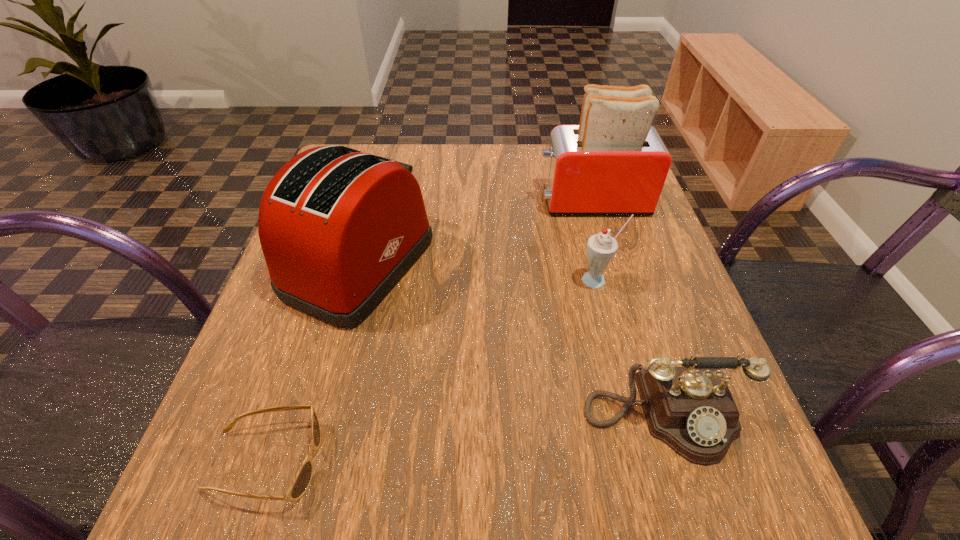
This screenshot has width=960, height=540. Find the location of `free area in between the left toaster and the milkshake`. free area in between the left toaster and the milkshake is located at coordinates (479, 273).

The image size is (960, 540). I want to click on object that is the second closest to the right toaster, so click(x=339, y=228).

Where is `the third closest object to the right toaster`? The height and width of the screenshot is (540, 960). the third closest object to the right toaster is located at coordinates (690, 409).

Image resolution: width=960 pixels, height=540 pixels. What are the coordinates of `vacant space that satisfies the following two spatial constraints: 1. on the straw side of the milkshake; 2. on the front-facing side of the sunglasses` in the screenshot? It's located at (645, 461).

Locate an element on the screen. The image size is (960, 540). free space that satisfies the following two spatial constraints: 1. on the dial of the telephone; 2. on the front-facing side of the sunglasses is located at coordinates [x=677, y=461].

Where is `free location that satisfies the following two spatial constraints: 1. on the dial of the telephone; 2. on the front-facing side of the shortest object`? This screenshot has width=960, height=540. free location that satisfies the following two spatial constraints: 1. on the dial of the telephone; 2. on the front-facing side of the shortest object is located at coordinates (677, 461).

Locate an element on the screen. This screenshot has height=540, width=960. vacant region that satisfies the following two spatial constraints: 1. on the dial of the telephone; 2. on the front-facing side of the shortest object is located at coordinates (677, 461).

The image size is (960, 540). I want to click on free space that satisfies the following two spatial constraints: 1. on the front side of the left toaster; 2. on the front-facing side of the sunglasses, so click(x=306, y=461).

Identify the location of vacant area in the image that satisfies the following two spatial constraints: 1. on the straw side of the milkshake; 2. on the front-facing side of the sunglasses. (645, 461).